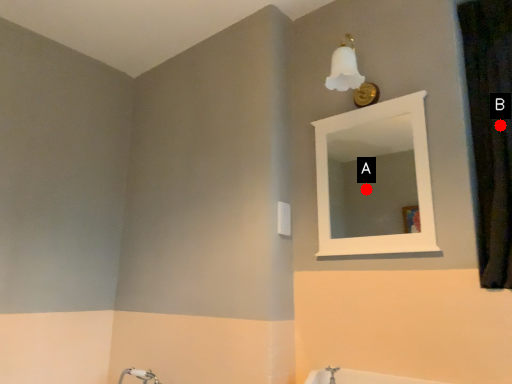
Question: Two points are circled on the image, labeled by A and B beside each circle. Which point is closer to the camera taking this photo?

Choices:
 (A) A is closer
 (B) B is closer

Answer: (B)